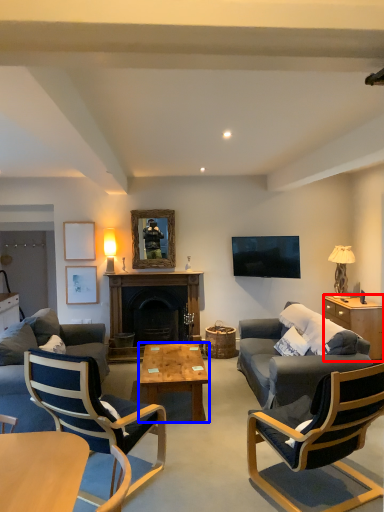
Question: Among these objects, which one is nearest to the camera, cabinetry (highlighted by a red box) or coffee table (highlighted by a blue box)?

Choices:
 (A) cabinetry
 (B) coffee table

Answer: (B)